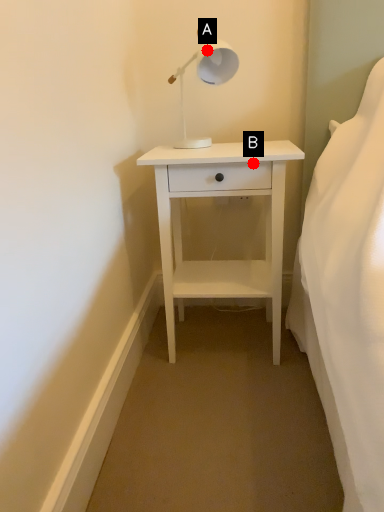
Question: Two points are circled on the image, labeled by A and B beside each circle. Which point appears closest to the camera in this image?

Choices:
 (A) A is closer
 (B) B is closer

Answer: (B)